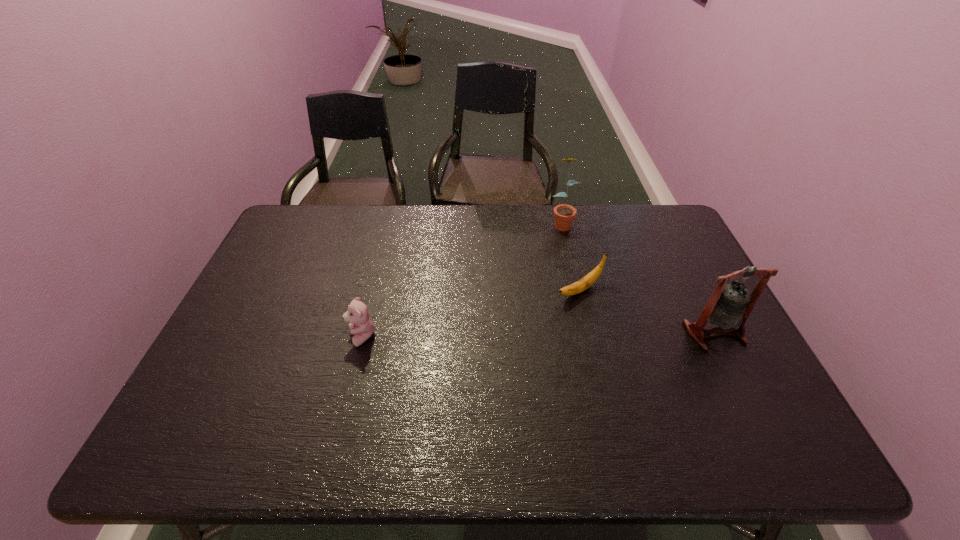
At what (x,y) coordinates should I click in order to perform the action: click on vacant space situated 0.180m on the flower of the farthest object. Please return your answer as a coordinate pair (x, y). The height and width of the screenshot is (540, 960). Looking at the image, I should click on (574, 269).

This screenshot has height=540, width=960. I want to click on free space located on the flower of the farthest object, so click(x=580, y=292).

The height and width of the screenshot is (540, 960). I want to click on free region located on the flower of the farthest object, so click(x=566, y=242).

Identify the location of vacant space located 0.380m on the peel of the shortest object from the top. (451, 363).

This screenshot has width=960, height=540. Find the location of `vacant space located 0.270m on the peel of the shortest object from the top`. vacant space located 0.270m on the peel of the shortest object from the top is located at coordinates (487, 342).

This screenshot has width=960, height=540. I want to click on vacant space located on the peel of the shortest object from the top, so click(448, 365).

At what (x,y) coordinates should I click in order to perform the action: click on object situated at the far edge. Please return your answer as a coordinate pair (x, y). The image size is (960, 540). Looking at the image, I should click on (564, 214).

Where is `object that is at the right edge`? Image resolution: width=960 pixels, height=540 pixels. object that is at the right edge is located at coordinates (730, 305).

In order to click on blank area at the far edge in this screenshot , I will do `click(495, 212)`.

Identify the location of blank area at the near edge. (496, 395).